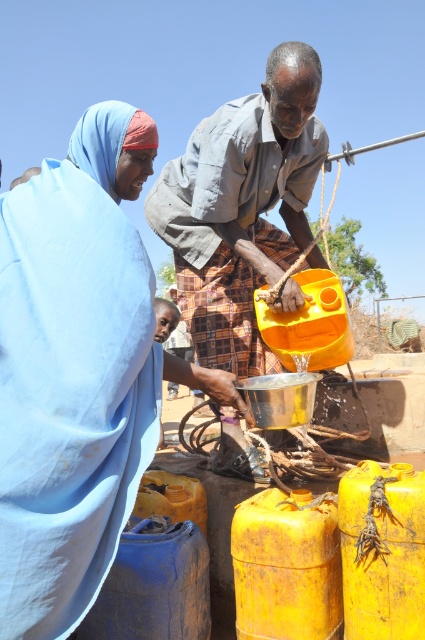
You are a visitor at this well. You want to fill your water bottle, but you are concerned about reaching the water source. Considering the height of the matte gray shirt at center and the yellow matte plastic barrel at center, which one is taller and could help you determine if you can reach the water source?

The matte gray shirt at center is much taller than the yellow matte plastic barrel at center. Since the shirt is taller, it might indicate that the person wearing it can reach higher, so you might need to ask for assistance if you cannot reach the water source yourself.